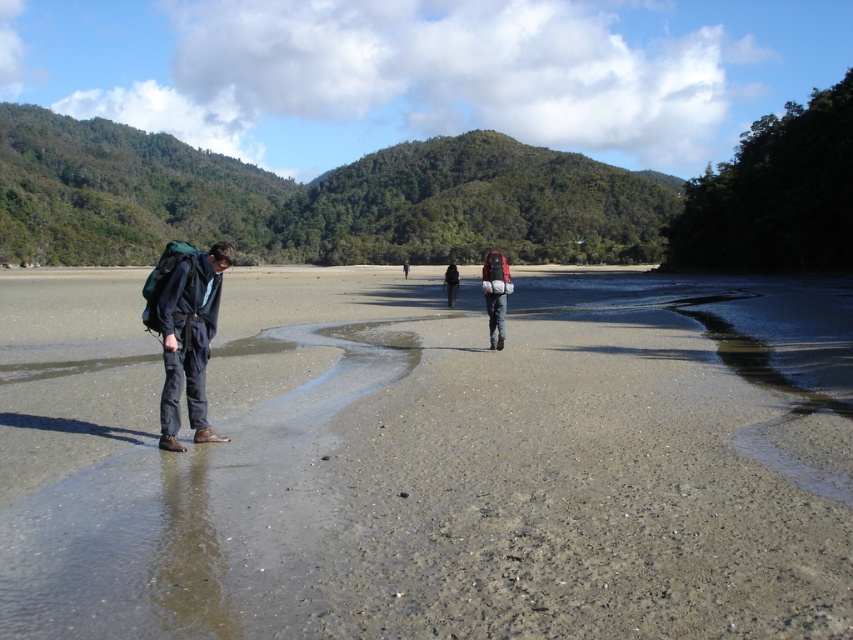
Does sandy beach at lower left appear over matte gray backpack at center?

Yes, sandy beach at lower left is above matte gray backpack at center.

Which is above, sandy beach at lower left or matte gray backpack at center?

Positioned higher is sandy beach at lower left.

Who is more distant from viewer, (x=412, y=387) or (x=496, y=308)?

The point (x=496, y=308) is more distant.

At what (x,y) coordinates should I click in order to perform the action: click on sandy beach at lower left. Please return your answer as a coordinate pair (x, y). This screenshot has height=640, width=853. Looking at the image, I should click on (431, 460).

Between dark blue fabric pants at left and dark gray pants at center, which one has more height?

Standing taller between the two is dark gray pants at center.

Is dark blue fabric pants at left further to the viewer compared to dark gray pants at center?

No, it is not.

This screenshot has width=853, height=640. What are the coordinates of `dark blue fabric pants at left` in the screenshot? It's located at (184, 332).

Does sandy beach at lower left have a smaller size compared to dark gray pants at center?

No.

Does point (473, 419) lie behind point (404, 268)?

That is False.

Locate an element on the screen. The height and width of the screenshot is (640, 853). sandy beach at lower left is located at coordinates (431, 460).

Identify the location of sandy beach at lower left. (431, 460).